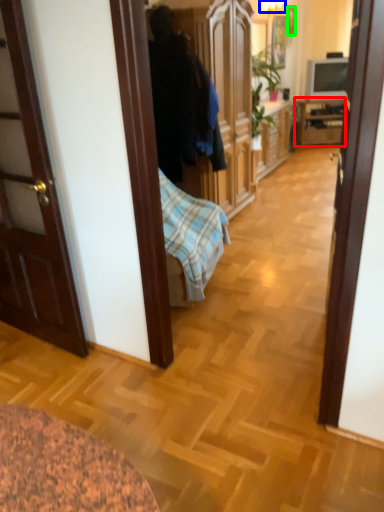
Question: Which object is the farthest from cabinetry (highlighted by a red box)? Choose among these: lamp (highlighted by a blue box) or picture frame (highlighted by a green box).

Choices:
 (A) lamp
 (B) picture frame

Answer: (A)